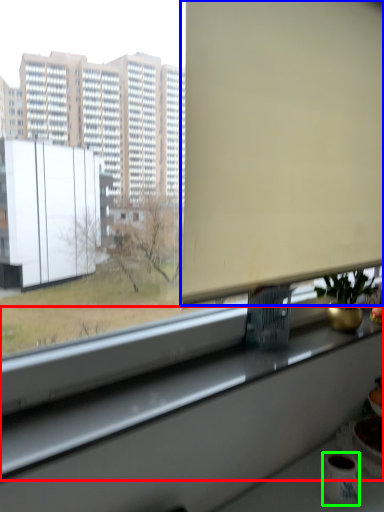
Question: Which object is the farthest from window sill (highlighted by a red box)? Choose among these: window screen (highlighted by a blue box) or mug (highlighted by a green box).

Choices:
 (A) window screen
 (B) mug

Answer: (A)